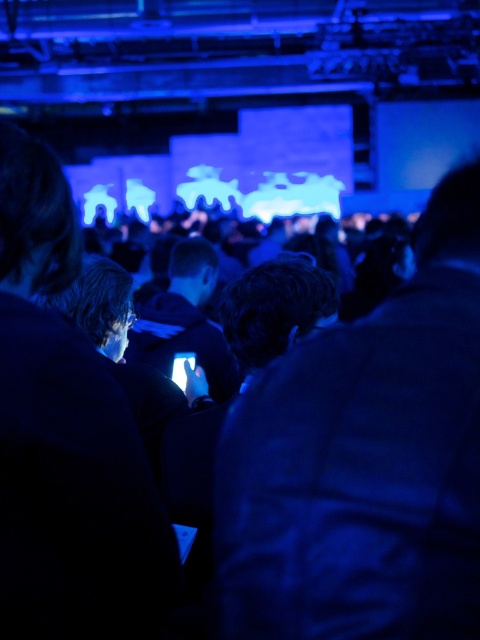
Can you confirm if dark blue leather jacket at center is positioned above matte black laptop at left?

Correct, dark blue leather jacket at center is located above matte black laptop at left.

Can you confirm if dark blue leather jacket at center is positioned below matte black laptop at left?

No.

Is point (243, 586) farther from viewer compared to point (14, 468)?

That is False.

Identify the location of dark blue leather jacket at center. Image resolution: width=480 pixels, height=640 pixels. (363, 461).